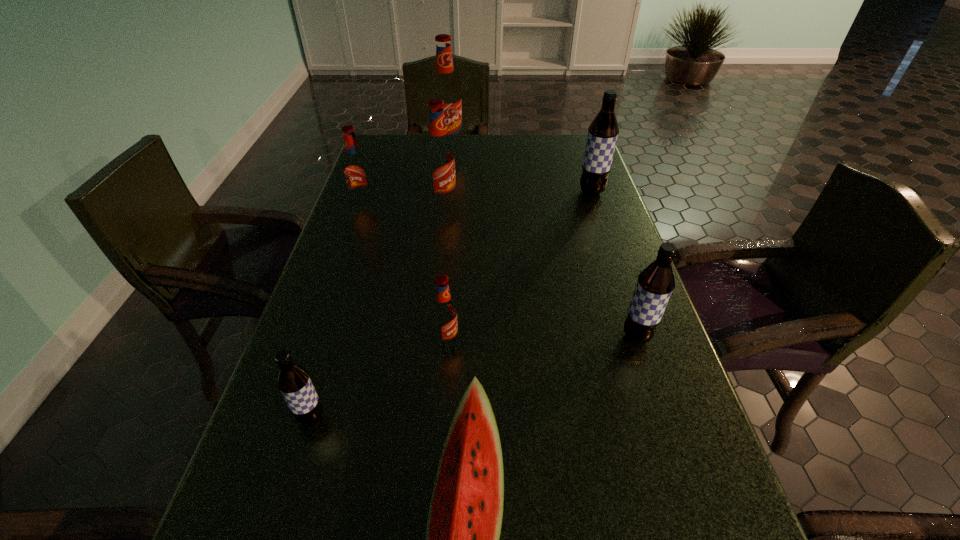
This screenshot has width=960, height=540. Identify the location of root beer that is the fourth closest to the second biggest brown root beer. (293, 381).

Select which root beer is the fifth closest to the tallest root beer. Please provide its 2D coordinates. Your answer should be formatted as a tuple, i.e. [(x, y)], where the tuple contains the x and y coordinates of a point satisfying the conditions above.

[(655, 284)]

Where is `red root beer that stands as the third closest to the second smallest red root beer`? red root beer that stands as the third closest to the second smallest red root beer is located at coordinates (444, 313).

Where is `red root beer that is the fourth closest to the second biggest brown root beer`? The width and height of the screenshot is (960, 540). red root beer that is the fourth closest to the second biggest brown root beer is located at coordinates (445, 87).

Locate an element on the screen. The image size is (960, 540). brown root beer that stands as the second closest to the smallest red root beer is located at coordinates (655, 284).

Choose which brown root beer is the nearest neighbor to the second nearest brown root beer. Please provide its 2D coordinates. Your answer should be formatted as a tuple, i.e. [(x, y)], where the tuple contains the x and y coordinates of a point satisfying the conditions above.

[(603, 131)]

Locate an element on the screen. The width and height of the screenshot is (960, 540). free space in the image that satisfies the following two spatial constraints: 1. on the back side of the second farthest brown root beer; 2. on the left side of the farthest brown root beer is located at coordinates (588, 192).